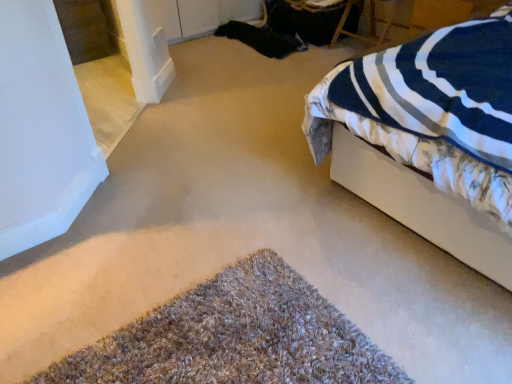
At what (x,y) coordinates should I click in order to perform the action: click on wooden chair at upper right. Please return your answer as a coordinate pair (x, y). The width and height of the screenshot is (512, 384). Looking at the image, I should click on (369, 23).

The height and width of the screenshot is (384, 512). I want to click on brown shaggy carpet at lower center, so click(x=234, y=337).

Considering the sizes of objects wooden chair at upper right and brown shaggy carpet at lower center in the image provided, who is wider, wooden chair at upper right or brown shaggy carpet at lower center?

brown shaggy carpet at lower center.

From a real-world perspective, which is physically above, wooden chair at upper right or brown shaggy carpet at lower center?

wooden chair at upper right.

Is wooden chair at upper right looking in the opposite direction of brown shaggy carpet at lower center?

wooden chair at upper right does not have its back to brown shaggy carpet at lower center.

Identify the location of chair behind the brown shaggy carpet at lower center. Image resolution: width=512 pixels, height=384 pixels. (369, 23).

Considering the sizes of objects brown shaggy carpet at lower center and wooden chair at upper right in the image provided, who is wider, brown shaggy carpet at lower center or wooden chair at upper right?

With larger width is brown shaggy carpet at lower center.

From the image's perspective, which is below, brown shaggy carpet at lower center or wooden chair at upper right?

brown shaggy carpet at lower center, from the image's perspective.

Is brown shaggy carpet at lower center shorter than wooden chair at upper right?

Correct, brown shaggy carpet at lower center is not as tall as wooden chair at upper right.

Which point is more forward, (303, 313) or (368, 41)?

The point (303, 313) is in front.

Can you tell me how much white fabric bed at right and wooden chair at upper right differ in facing direction?

0.65 degrees separate the facing orientations of white fabric bed at right and wooden chair at upper right.

Which is less distant, (483, 155) or (352, 34)?

Positioned in front is point (483, 155).

Considering the relative positions of white fabric bed at right and wooden chair at upper right in the image provided, is white fabric bed at right behind wooden chair at upper right?

No, white fabric bed at right is closer to the viewer.

The width and height of the screenshot is (512, 384). In order to click on bed lying on the right of brown shaggy carpet at lower center in this screenshot , I will do `click(429, 137)`.

Considering the relative sizes of brown shaggy carpet at lower center and white fabric bed at right in the image provided, is brown shaggy carpet at lower center taller than white fabric bed at right?

No, brown shaggy carpet at lower center is not taller than white fabric bed at right.

Can you confirm if brown shaggy carpet at lower center is wider than white fabric bed at right?

Incorrect, the width of brown shaggy carpet at lower center does not surpass that of white fabric bed at right.

Between brown shaggy carpet at lower center and white fabric bed at right, which one appears on the left side from the viewer's perspective?

Positioned to the left is brown shaggy carpet at lower center.

Does wooden chair at upper right have a lesser width compared to white fabric bed at right?

Yes, wooden chair at upper right is thinner than white fabric bed at right.

Between wooden chair at upper right and white fabric bed at right, which one has larger size?

white fabric bed at right.

From a real-world perspective, is wooden chair at upper right positioned above or below white fabric bed at right?

wooden chair at upper right is situated lower than white fabric bed at right in the real world.

Who is smaller, white fabric bed at right or brown shaggy carpet at lower center?

With smaller size is brown shaggy carpet at lower center.

At what (x,y) coordinates should I click in order to perform the action: click on door below the white fabric bed at right (from the image's perspective). Please return your answer as a coordinate pair (x, y). The width and height of the screenshot is (512, 384). Looking at the image, I should click on (234, 337).

How much distance is there between white fabric bed at right and brown shaggy carpet at lower center?

29.82 inches.

Which object is more forward, white fabric bed at right or brown shaggy carpet at lower center?

white fabric bed at right is closer to the camera.

This screenshot has width=512, height=384. In order to click on door beneath the wooden chair at upper right (from a real-world perspective) in this screenshot , I will do `click(234, 337)`.

Find the location of a particular element. chair on the right side of brown shaggy carpet at lower center is located at coordinates (369, 23).

From the image, which object appears to be farther from brown shaggy carpet at lower center, wooden chair at upper right or white fabric bed at right?

Based on the image, wooden chair at upper right appears to be further to brown shaggy carpet at lower center.

Looking at the image, which one is located further to wooden chair at upper right, white fabric bed at right or brown shaggy carpet at lower center?

Among the two, brown shaggy carpet at lower center is located further to wooden chair at upper right.

Consider the image. Considering their positions, is wooden chair at upper right positioned further to white fabric bed at right than brown shaggy carpet at lower center?

wooden chair at upper right is further to white fabric bed at right.

Which object lies nearer to the anchor point wooden chair at upper right, brown shaggy carpet at lower center or white fabric bed at right?

white fabric bed at right is positioned closer to the anchor wooden chair at upper right.

Based on their spatial positions, is brown shaggy carpet at lower center or wooden chair at upper right closer to white fabric bed at right?

Among the two, brown shaggy carpet at lower center is located nearer to white fabric bed at right.

From the image, which object appears to be farther from brown shaggy carpet at lower center, white fabric bed at right or wooden chair at upper right?

The object further to brown shaggy carpet at lower center is wooden chair at upper right.

Find the location of `door positioned between white fabric bed at right and wooden chair at upper right from near to far`. door positioned between white fabric bed at right and wooden chair at upper right from near to far is located at coordinates (234, 337).